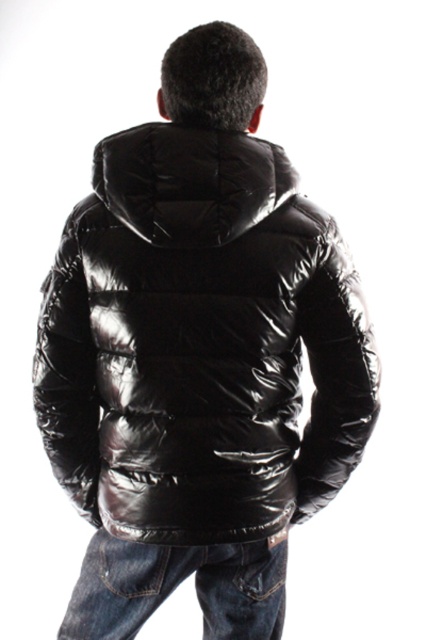
What do you see at coordinates (199, 342) in the screenshot?
I see `glossy black puffer jacket at center` at bounding box center [199, 342].

You are a GUI agent. You are given a task and a screenshot of the screen. Output one action in this format:
    pyautogui.click(x=<x>, y=<y>)
    Task: Click on the glossy black puffer jacket at center
    Image resolution: width=426 pixels, height=640 pixels.
    Given the screenshot: What is the action you would take?
    pyautogui.click(x=199, y=342)